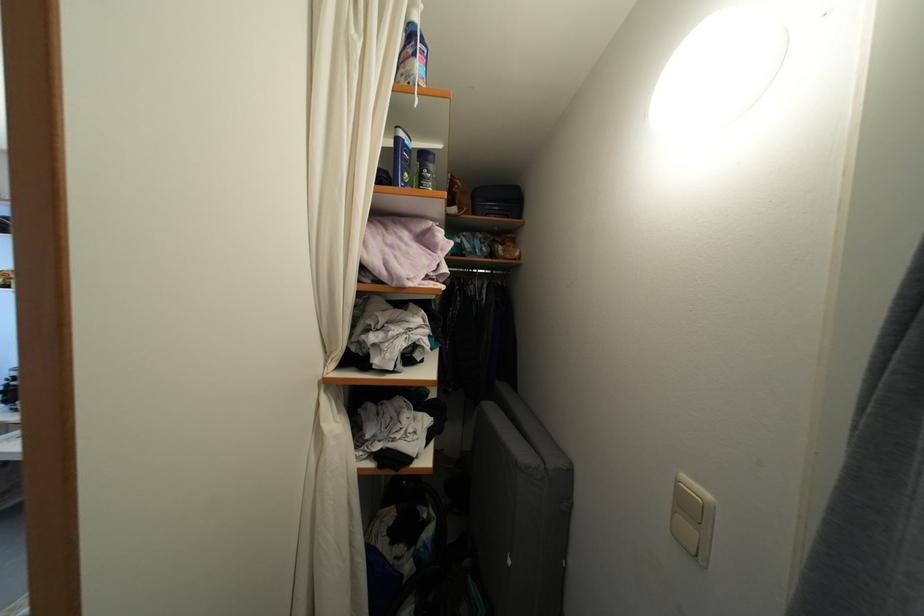
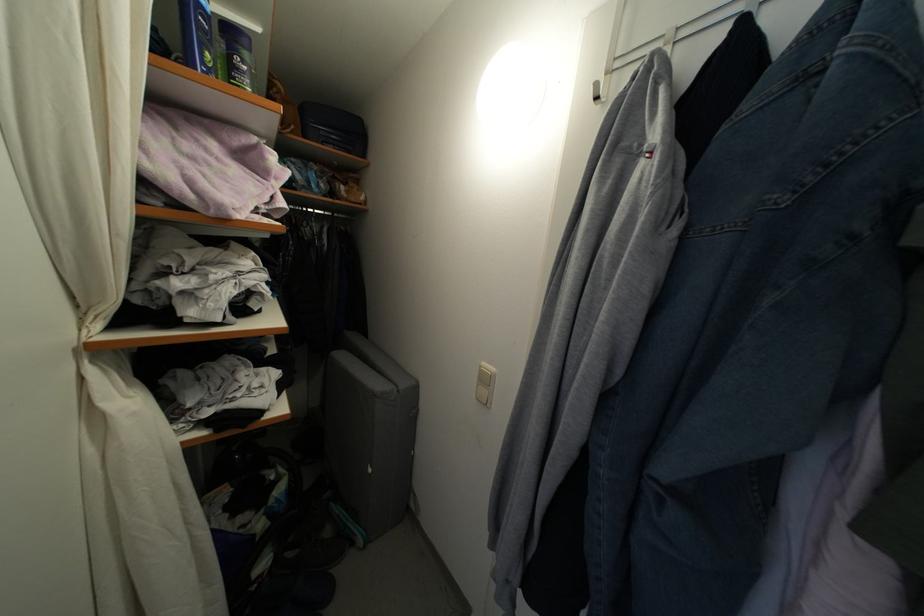
Question: Based on the continuous images, in which direction is the camera rotating? Reply with the corresponding letter.

Choices:
 (A) Left
 (B) Right
 (C) Up
 (D) Down

Answer: (B)